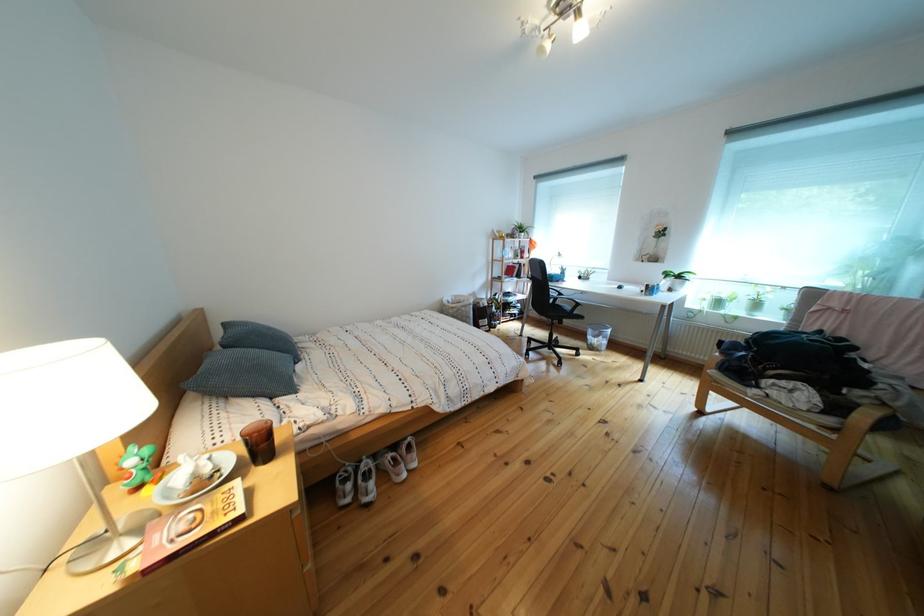
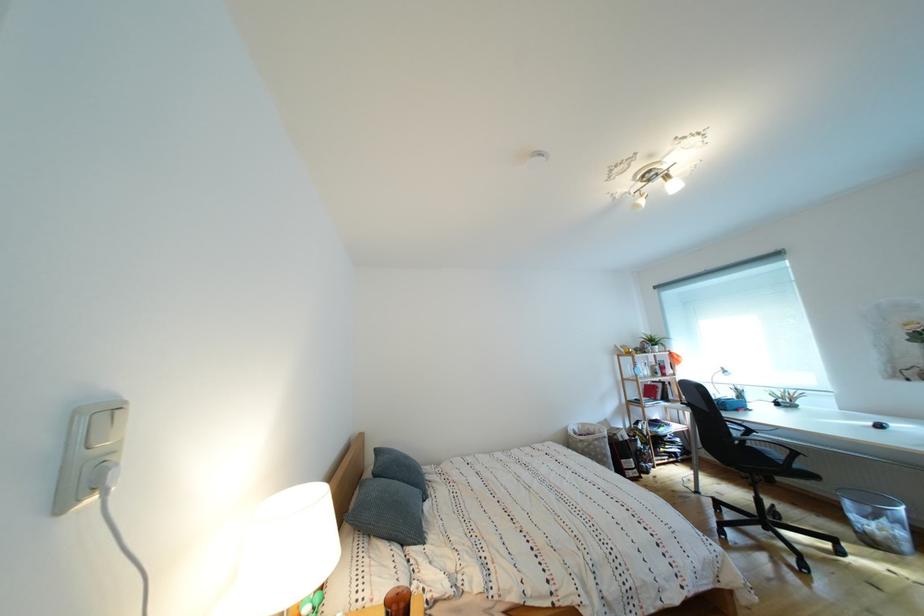
In the second image, find the point that corresponds to point 588,318 in the first image.

(808, 472)